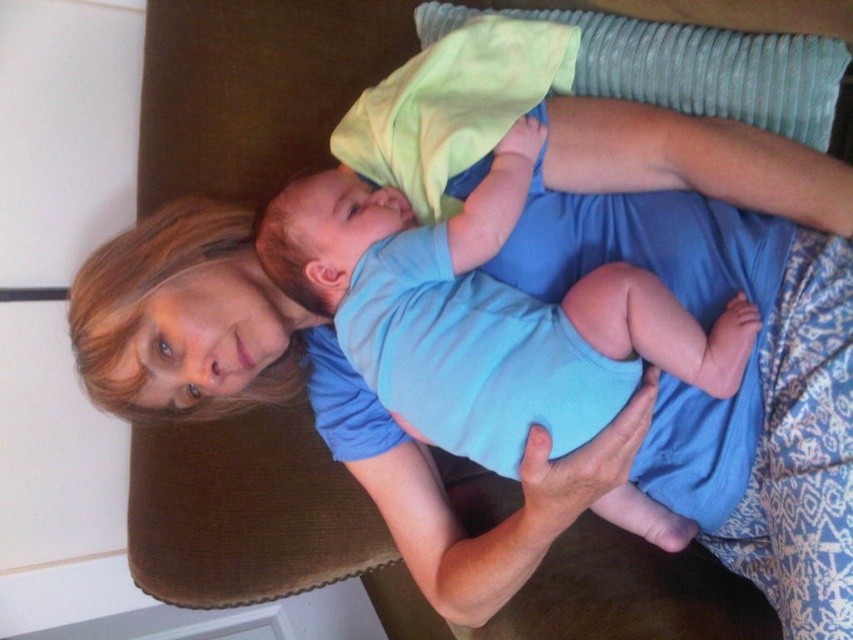
You are a photographer setting up a shoot. You need to place a small prop exactly at point (483, 314). What object will the prop be placed on?

The prop will be placed on the blue cotton onesie at center located at point (483, 314).

Looking at this image, you are a nurse preparing to place a small medical kit between the blue cotton onesie at center and the textured gray pillow at upper center. The kit is 10 inches long. Can it fit in the space between them?

The space between the blue cotton onesie at center and the textured gray pillow at upper center is 12.88 inches. Since the medical kit is 10 inches long, it can fit within the available space.

You are a photographer setting up a shot of the woman and baby. You want to focus on the blue cotton onesie at center and the textured gray pillow at upper center. Which object should you adjust your camera focus to first if you want to ensure both are in focus?

The blue cotton onesie at center should be focused on first since it is closer to the viewer than the textured gray pillow at upper center, allowing the photographer to adjust focus from near to far to include both in the frame.